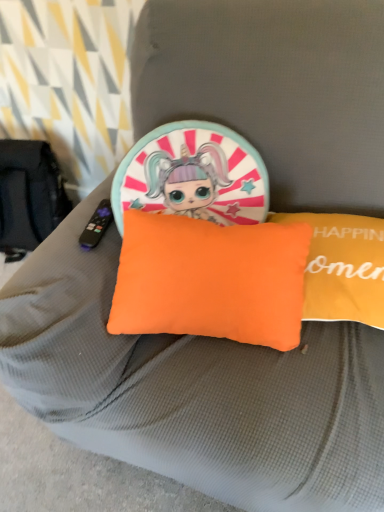
The image size is (384, 512). What do you see at coordinates (210, 279) in the screenshot? I see `orange fabric pillow at center, the second pillow when ordered from right to left` at bounding box center [210, 279].

Identify the location of orange fabric pillow at center, the second pillow when ordered from right to left. (210, 279).

In order to face orange fabric pillow at center, marked as the first pillow in a left-to-right arrangement, should I rotate leftwards or rightwards?

A 2.614 degree turn to the right will do.

You are a GUI agent. You are given a task and a screenshot of the screen. Output one action in this format:
    pyautogui.click(x=<x>, y=<y>)
    Task: Click on the orange fabric pillow at center, which is counted as the 1th pillow, starting from the right
    The width and height of the screenshot is (384, 512).
    Given the screenshot: What is the action you would take?
    pyautogui.click(x=342, y=267)

The width and height of the screenshot is (384, 512). What do you see at coordinates (342, 267) in the screenshot?
I see `orange fabric pillow at center, the 2th pillow viewed from the left` at bounding box center [342, 267].

Identify the location of orange fabric pillow at center, marked as the first pillow in a left-to-right arrangement. Image resolution: width=384 pixels, height=512 pixels. (210, 279).

Visually, is orange fabric pillow at center, the 2th pillow viewed from the left, positioned to the left or to the right of orange fabric pillow at center, marked as the first pillow in a left-to-right arrangement?

In the image, orange fabric pillow at center, the 2th pillow viewed from the left, appears on the right side of orange fabric pillow at center, marked as the first pillow in a left-to-right arrangement.

Between orange fabric pillow at center, which is counted as the 1th pillow, starting from the right, and orange fabric pillow at center, marked as the first pillow in a left-to-right arrangement, which one is positioned behind?

orange fabric pillow at center, which is counted as the 1th pillow, starting from the right, is further away from the camera.

Considering the positions of point (381, 225) and point (198, 221), is point (381, 225) closer or farther from the camera than point (198, 221)?

Point (381, 225) appears to be farther away from the viewer than point (198, 221).

From the image's perspective, between orange fabric pillow at center, the 2th pillow viewed from the left, and orange fabric pillow at center, marked as the first pillow in a left-to-right arrangement, which one is located above?

orange fabric pillow at center, the 2th pillow viewed from the left, appears higher in the image.

From a real-world perspective, is orange fabric pillow at center, the 2th pillow viewed from the left, under orange fabric pillow at center, the second pillow when ordered from right to left?

Indeed, from a real-world perspective, orange fabric pillow at center, the 2th pillow viewed from the left, is positioned beneath orange fabric pillow at center, the second pillow when ordered from right to left.

Considering the sizes of orange fabric pillow at center, the 2th pillow viewed from the left, and orange fabric pillow at center, marked as the first pillow in a left-to-right arrangement, in the image, is orange fabric pillow at center, the 2th pillow viewed from the left, wider or thinner than orange fabric pillow at center, marked as the first pillow in a left-to-right arrangement,?

orange fabric pillow at center, the 2th pillow viewed from the left, is wider than orange fabric pillow at center, marked as the first pillow in a left-to-right arrangement.

Considering the sizes of objects orange fabric pillow at center, the 2th pillow viewed from the left, and orange fabric pillow at center, marked as the first pillow in a left-to-right arrangement, in the image provided, who is shorter, orange fabric pillow at center, the 2th pillow viewed from the left, or orange fabric pillow at center, marked as the first pillow in a left-to-right arrangement,?

orange fabric pillow at center, the 2th pillow viewed from the left, is shorter.

Considering the relative sizes of orange fabric pillow at center, the 2th pillow viewed from the left, and orange fabric pillow at center, the second pillow when ordered from right to left, in the image provided, is orange fabric pillow at center, the 2th pillow viewed from the left, bigger than orange fabric pillow at center, the second pillow when ordered from right to left,?

Incorrect, orange fabric pillow at center, the 2th pillow viewed from the left, is not larger than orange fabric pillow at center, the second pillow when ordered from right to left.

Choose the correct answer: Is orange fabric pillow at center, which is counted as the 1th pillow, starting from the right, inside orange fabric pillow at center, marked as the first pillow in a left-to-right arrangement, or outside it?

orange fabric pillow at center, which is counted as the 1th pillow, starting from the right, exists outside the volume of orange fabric pillow at center, marked as the first pillow in a left-to-right arrangement.

Does orange fabric pillow at center, which is counted as the 1th pillow, starting from the right, touch orange fabric pillow at center, marked as the first pillow in a left-to-right arrangement?

No, orange fabric pillow at center, which is counted as the 1th pillow, starting from the right, is not in contact with orange fabric pillow at center, marked as the first pillow in a left-to-right arrangement.

From the picture: Is orange fabric pillow at center, the 2th pillow viewed from the left, facing away from orange fabric pillow at center, the second pillow when ordered from right to left?

No, orange fabric pillow at center, the 2th pillow viewed from the left,'s orientation is not away from orange fabric pillow at center, the second pillow when ordered from right to left.

How different are the orientations of orange fabric pillow at center, which is counted as the 1th pillow, starting from the right, and orange fabric pillow at center, marked as the first pillow in a left-to-right arrangement, in degrees?

There is a 4.66-degree angle between the facing directions of orange fabric pillow at center, which is counted as the 1th pillow, starting from the right, and orange fabric pillow at center, marked as the first pillow in a left-to-right arrangement.

Measure the distance from orange fabric pillow at center, the 2th pillow viewed from the left, to orange fabric pillow at center, the second pillow when ordered from right to left.

orange fabric pillow at center, the 2th pillow viewed from the left, is 7.18 inches from orange fabric pillow at center, the second pillow when ordered from right to left.

Where is `pillow to the left of orange fabric pillow at center, the 2th pillow viewed from the left`? This screenshot has width=384, height=512. pillow to the left of orange fabric pillow at center, the 2th pillow viewed from the left is located at coordinates (210, 279).

Which object is positioned more to the right, orange fabric pillow at center, the second pillow when ordered from right to left, or orange fabric pillow at center, which is counted as the 1th pillow, starting from the right?

Positioned to the right is orange fabric pillow at center, which is counted as the 1th pillow, starting from the right.

Does orange fabric pillow at center, marked as the first pillow in a left-to-right arrangement, lie behind orange fabric pillow at center, the 2th pillow viewed from the left?

No, the depth of orange fabric pillow at center, marked as the first pillow in a left-to-right arrangement, is less than that of orange fabric pillow at center, the 2th pillow viewed from the left.

Between point (283, 236) and point (299, 214), which one is positioned behind?

Point (299, 214)

From the image's perspective, is orange fabric pillow at center, marked as the first pillow in a left-to-right arrangement, below orange fabric pillow at center, the 2th pillow viewed from the left?

Indeed, from the image's perspective, orange fabric pillow at center, marked as the first pillow in a left-to-right arrangement, is shown beneath orange fabric pillow at center, the 2th pillow viewed from the left.

From a real-world perspective, is orange fabric pillow at center, the second pillow when ordered from right to left, beneath orange fabric pillow at center, the 2th pillow viewed from the left?

No, from a real-world perspective, orange fabric pillow at center, the second pillow when ordered from right to left, is not beneath orange fabric pillow at center, the 2th pillow viewed from the left.

From the picture: Can you confirm if orange fabric pillow at center, the second pillow when ordered from right to left, is thinner than orange fabric pillow at center, which is counted as the 1th pillow, starting from the right?

Indeed, orange fabric pillow at center, the second pillow when ordered from right to left, has a lesser width compared to orange fabric pillow at center, which is counted as the 1th pillow, starting from the right.

Does orange fabric pillow at center, marked as the first pillow in a left-to-right arrangement, have a greater height compared to orange fabric pillow at center, which is counted as the 1th pillow, starting from the right?

Indeed, orange fabric pillow at center, marked as the first pillow in a left-to-right arrangement, has a greater height compared to orange fabric pillow at center, which is counted as the 1th pillow, starting from the right.

In terms of size, does orange fabric pillow at center, the second pillow when ordered from right to left, appear bigger or smaller than orange fabric pillow at center, the 2th pillow viewed from the left?

In the image, orange fabric pillow at center, the second pillow when ordered from right to left, appears to be larger than orange fabric pillow at center, the 2th pillow viewed from the left.

Is orange fabric pillow at center, the second pillow when ordered from right to left, not inside orange fabric pillow at center, which is counted as the 1th pillow, starting from the right?

Yes, orange fabric pillow at center, the second pillow when ordered from right to left, is outside of orange fabric pillow at center, which is counted as the 1th pillow, starting from the right.

Is orange fabric pillow at center, marked as the first pillow in a left-to-right arrangement, not close to orange fabric pillow at center, which is counted as the 1th pillow, starting from the right?

No, orange fabric pillow at center, marked as the first pillow in a left-to-right arrangement, is not far from orange fabric pillow at center, which is counted as the 1th pillow, starting from the right.

Is orange fabric pillow at center, the second pillow when ordered from right to left, aimed at orange fabric pillow at center, which is counted as the 1th pillow, starting from the right?

No, orange fabric pillow at center, the second pillow when ordered from right to left, does not turn towards orange fabric pillow at center, which is counted as the 1th pillow, starting from the right.

What's the angular difference between orange fabric pillow at center, marked as the first pillow in a left-to-right arrangement, and orange fabric pillow at center, which is counted as the 1th pillow, starting from the right,'s facing directions?

The angular difference between orange fabric pillow at center, marked as the first pillow in a left-to-right arrangement, and orange fabric pillow at center, which is counted as the 1th pillow, starting from the right, is 4.66 degrees.

Find the location of `pillow below the orange fabric pillow at center, the 2th pillow viewed from the left (from the image's perspective)`. pillow below the orange fabric pillow at center, the 2th pillow viewed from the left (from the image's perspective) is located at coordinates (210, 279).

What are the coordinates of `pillow below the orange fabric pillow at center, marked as the first pillow in a left-to-right arrangement (from a real-world perspective)` in the screenshot? It's located at (342, 267).

You are a GUI agent. You are given a task and a screenshot of the screen. Output one action in this format:
    pyautogui.click(x=<x>, y=<y>)
    Task: Click on the pillow above the orange fabric pillow at center, marked as the first pillow in a left-to-right arrangement (from the image's perspective)
    
    Given the screenshot: What is the action you would take?
    pyautogui.click(x=342, y=267)